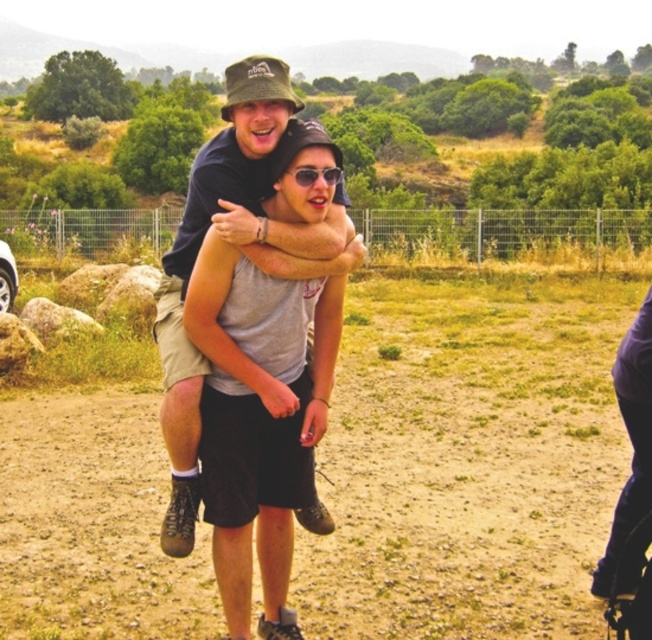
Question: Does dull brown dirt at center have a lesser width compared to sunglasses at center?

Choices:
 (A) yes
 (B) no

Answer: (B)

Question: Considering the real-world distances, which object is farthest from the sunglasses at center?

Choices:
 (A) matte black shirt at center
 (B) dull brown dirt at center

Answer: (B)

Question: Based on their relative distances, which object is farther from the matte black shirt at center?

Choices:
 (A) sunglasses at center
 (B) dull brown dirt at center

Answer: (B)

Question: Can you confirm if matte black shirt at center is wider than sunglasses at center?

Choices:
 (A) no
 (B) yes

Answer: (B)

Question: Does dull brown dirt at center appear over sunglasses at center?

Choices:
 (A) yes
 (B) no

Answer: (B)

Question: Based on their relative distances, which object is farther from the matte black shirt at center?

Choices:
 (A) dull brown dirt at center
 (B) sunglasses at center

Answer: (A)